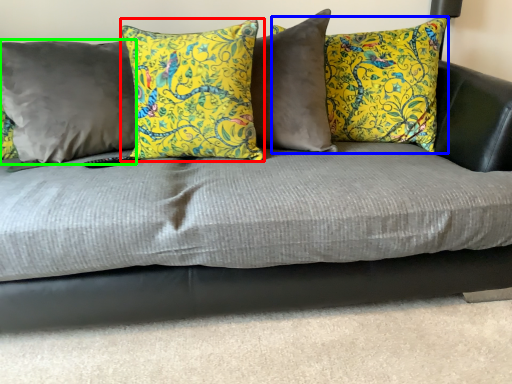
Question: Considering the real-world distances, which object is closest to pillow (highlighted by a red box)? pillow (highlighted by a blue box) or pillow (highlighted by a green box).

Choices:
 (A) pillow
 (B) pillow

Answer: (B)